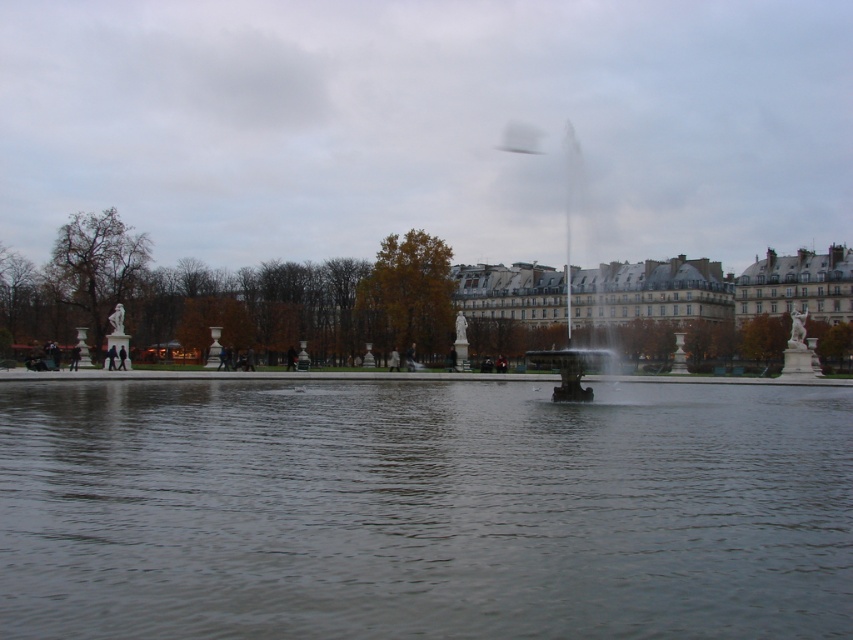
You are standing at the point marked as point (759,608) in the image. The statues are 11.76 meters away from you. Can you see the statues clearly?

The statues are 11.76 meters away from the point (759,608), so yes, you can see them clearly from that distance.

You are a tourist in the park and want to take a photo of both the transparent water at center and the polished bronze fountain at center. Since you want them both in the frame, which object should you position closer to the left side of your camera viewfinder?

The transparent water at center should be positioned closer to the left side of your camera viewfinder because it is already located on the left side of the polished bronze fountain at center.